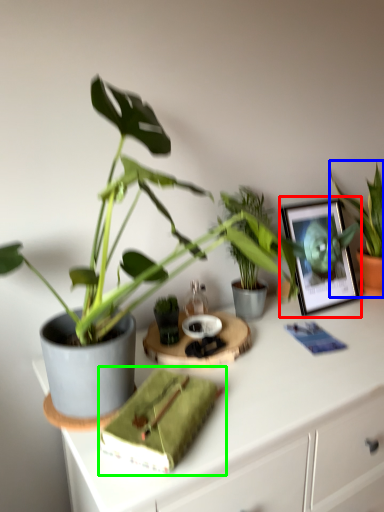
Question: Estimate the real-world distances between objects in this image. Which object is farther from picture frame (highlighted by a red box), houseplant (highlighted by a blue box) or book (highlighted by a green box)?

Choices:
 (A) houseplant
 (B) book

Answer: (B)